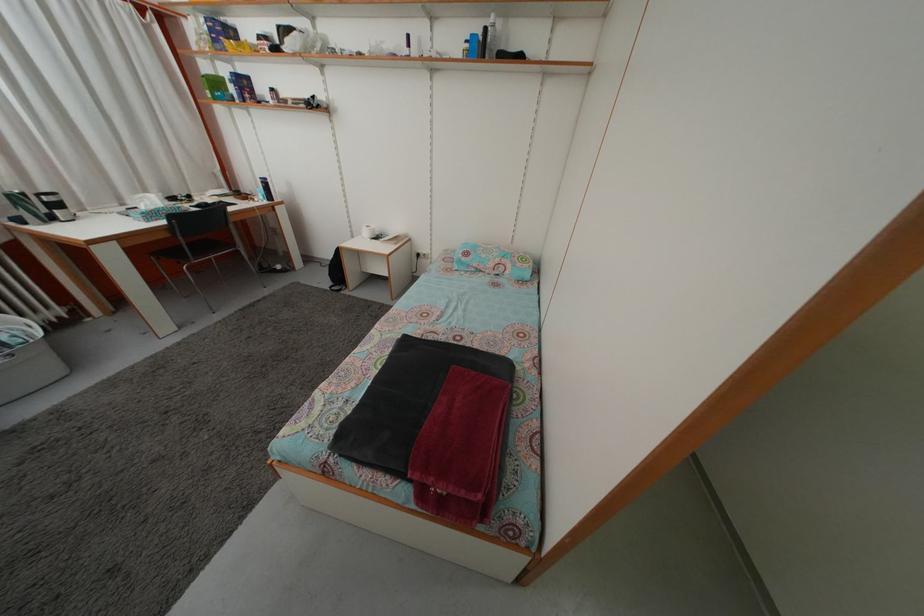
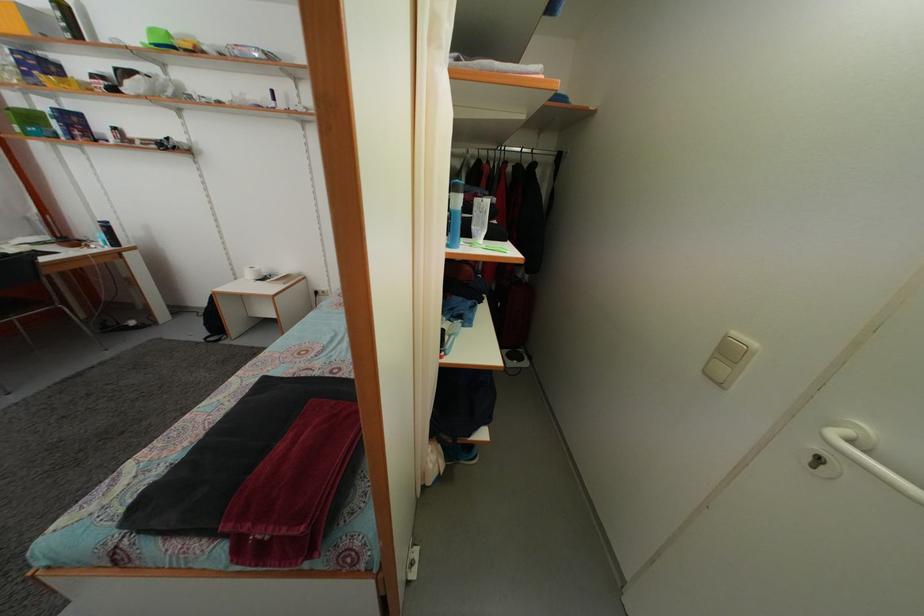
Question: The camera is either moving clockwise (left) or counter-clockwise (right) around the object. The first image is from the beginning of the video and the second image is from the end. Is the camera moving left or right when shooting the video?

Choices:
 (A) Left
 (B) Right

Answer: (A)